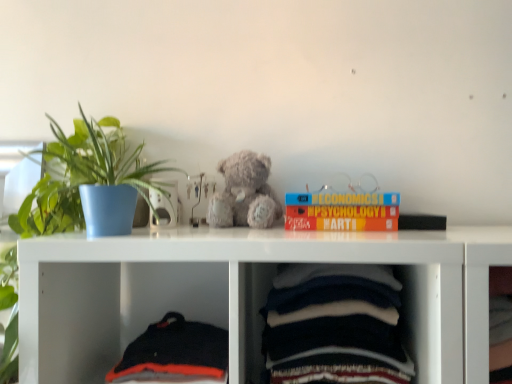
Question: Considering the positions of black cotton sweater at lower left, the 2th baby clothe viewed from the right, and dark blue cotton baby clothes at lower center, the first baby clothe positioned from the right, in the image, is black cotton sweater at lower left, the 2th baby clothe viewed from the right, wider or thinner than dark blue cotton baby clothes at lower center, the first baby clothe positioned from the right,?

Choices:
 (A) wide
 (B) thin

Answer: (A)

Question: In the image, is black cotton sweater at lower left, the first baby clothe positioned from the left, positioned in front of or behind dark blue cotton baby clothes at lower center, the first baby clothe positioned from the right?

Choices:
 (A) behind
 (B) front

Answer: (A)

Question: Which object is the closest to the black matte book at upper right, marked as the first book in a right-to-left arrangement?

Choices:
 (A) green leafy plant in blue pot at left
 (B) dark blue cotton baby clothes at lower center, the first baby clothe positioned from the right
 (C) hardcover book at upper center, the second book in the right-to-left sequence
 (D) black cotton sweater at lower left, the first baby clothe positioned from the left
 (E) fuzzy gray teddy bear at center

Answer: (C)

Question: Estimate the real-world distances between objects in this image. Which object is farther from the black matte book at upper right, marked as the first book in a right-to-left arrangement?

Choices:
 (A) green leafy plant in blue pot at left
 (B) dark blue cotton baby clothes at lower center, the 2th baby clothe positioned from the left
 (C) fuzzy gray teddy bear at center
 (D) black cotton sweater at lower left, the 2th baby clothe viewed from the right
 (E) hardcover book at upper center, the second book in the right-to-left sequence

Answer: (A)